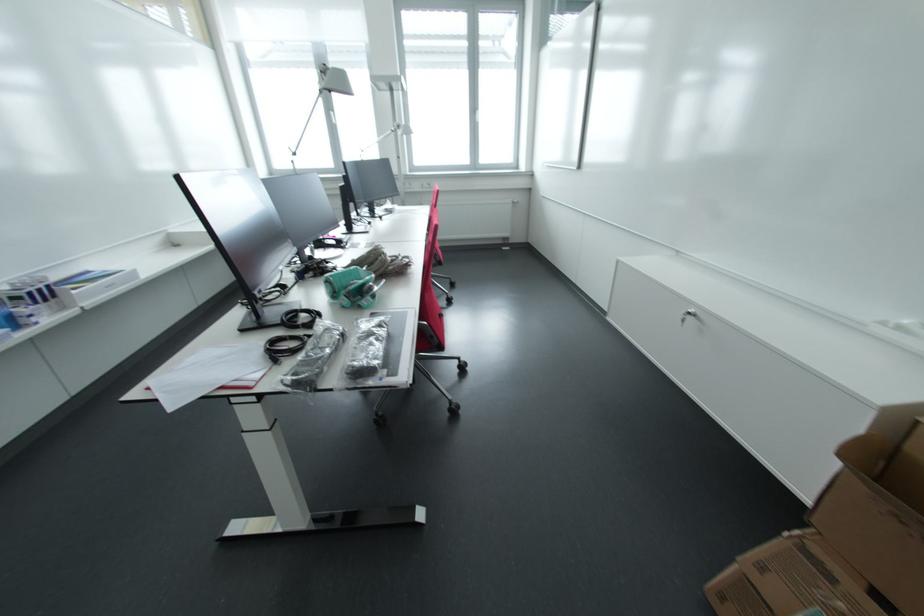
Which object does [843,543] point to?

It refers to a cardboard box.